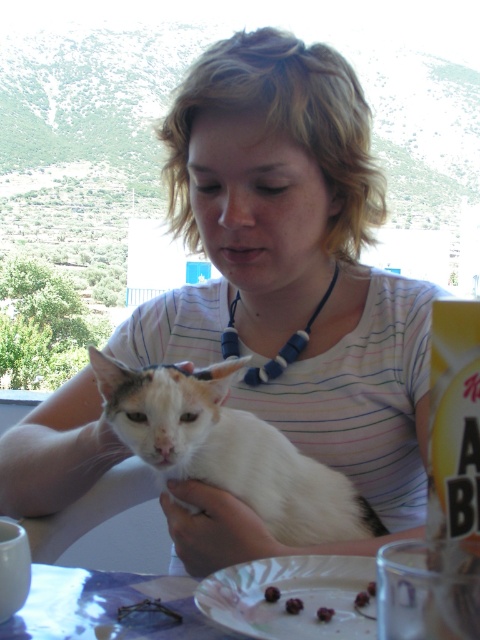
Question: Among these points, which one is farthest from the camera?

Choices:
 (A) (361, 595)
 (B) (299, 611)

Answer: (A)

Question: Which of the following is the closest to the observer?

Choices:
 (A) smooth brown cookie at lower center
 (B) smooth purple plum at center
 (C) white fur cat at center
 (D) smooth brown cherry at center

Answer: (D)

Question: Which point is farther from the camera taking this photo?

Choices:
 (A) (359, 604)
 (B) (240, 596)

Answer: (B)

Question: Can you confirm if white paper plate at lower center is positioned to the right of shiny dark chocolate cherry at plate center?

Choices:
 (A) no
 (B) yes

Answer: (B)

Question: Is white paper plate at lower center to the left of smooth purple plum at center from the viewer's perspective?

Choices:
 (A) no
 (B) yes

Answer: (A)

Question: From the image, what is the correct spatial relationship of white paper plate at lower center in relation to smooth brown cookie at lower center?

Choices:
 (A) right
 (B) left

Answer: (B)